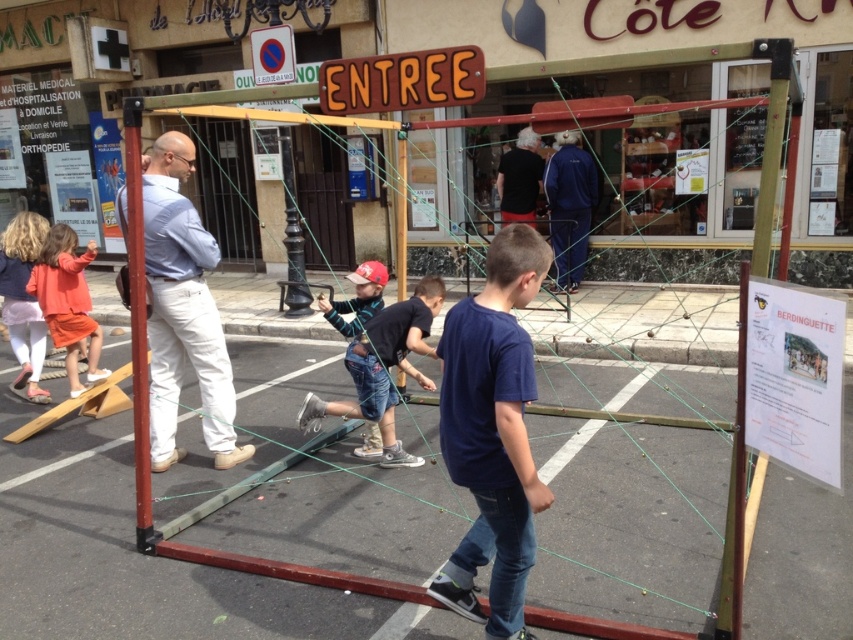
Does light blue shirt at center appear on the right side of denim jeans at center?

No, light blue shirt at center is not to the right of denim jeans at center.

Is point (195, 243) in front of point (430, 307)?

That is True.

Identify the location of light blue shirt at center. The width and height of the screenshot is (853, 640). (183, 308).

Does point (387, 412) lie behind point (532, 132)?

No, (387, 412) is closer to viewer.

Between denim jeans at center and black cotton shirt at center, which one is positioned higher?

black cotton shirt at center is higher up.

Where is `denim jeans at center`? Image resolution: width=853 pixels, height=640 pixels. denim jeans at center is located at coordinates (384, 369).

Consider the image. Can you confirm if denim jeans at center is smaller than orange cotton dress at left?

Correct, denim jeans at center occupies less space than orange cotton dress at left.

Which is more to the right, denim jeans at center or orange cotton dress at left?

denim jeans at center is more to the right.

Who is more distant from viewer, [433,353] or [70,360]?

The point [70,360] is behind.

The image size is (853, 640). Find the location of `denim jeans at center`. denim jeans at center is located at coordinates (384, 369).